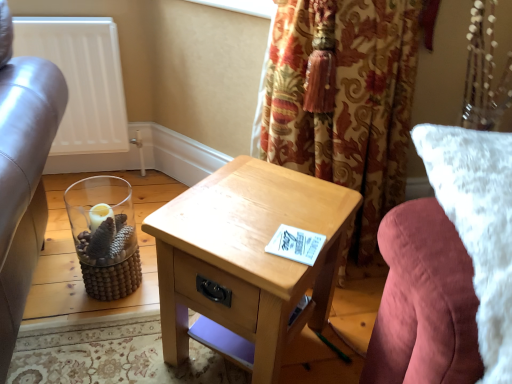
Question: Is light wood/texture nightstand at center thinner than white fluffy pillow at right?

Choices:
 (A) yes
 (B) no

Answer: (A)

Question: Is light wood/texture nightstand at center taller than white fluffy pillow at right?

Choices:
 (A) yes
 (B) no

Answer: (B)

Question: From the image's perspective, is light wood/texture nightstand at center located above white fluffy pillow at right?

Choices:
 (A) no
 (B) yes

Answer: (A)

Question: Can you confirm if light wood/texture nightstand at center is smaller than white fluffy pillow at right?

Choices:
 (A) yes
 (B) no

Answer: (A)

Question: Is light wood/texture nightstand at center positioned with its back to white fluffy pillow at right?

Choices:
 (A) no
 (B) yes

Answer: (A)

Question: Considering the relative positions of light wood/texture nightstand at center and white fluffy pillow at right in the image provided, is light wood/texture nightstand at center to the left of white fluffy pillow at right from the viewer's perspective?

Choices:
 (A) no
 (B) yes

Answer: (B)

Question: Does clear glass vase at lower left lie in front of white fluffy pillow at right?

Choices:
 (A) yes
 (B) no

Answer: (B)

Question: Is clear glass vase at lower left taller than white fluffy pillow at right?

Choices:
 (A) yes
 (B) no

Answer: (B)

Question: From the image's perspective, is clear glass vase at lower left below white fluffy pillow at right?

Choices:
 (A) no
 (B) yes

Answer: (B)

Question: From a real-world perspective, does clear glass vase at lower left stand above white fluffy pillow at right?

Choices:
 (A) yes
 (B) no

Answer: (B)

Question: Can you confirm if clear glass vase at lower left is wider than white fluffy pillow at right?

Choices:
 (A) no
 (B) yes

Answer: (A)

Question: Is clear glass vase at lower left far from white fluffy pillow at right?

Choices:
 (A) yes
 (B) no

Answer: (B)

Question: Does light wood/texture nightstand at center have a greater height compared to white matte radiator at upper left?

Choices:
 (A) yes
 (B) no

Answer: (B)